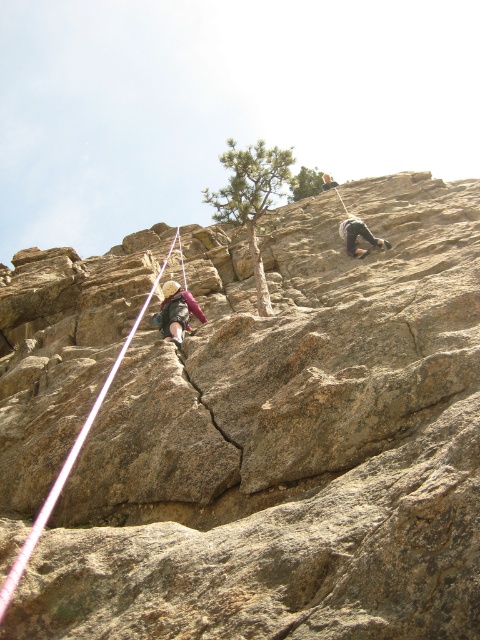
Based on the photo, does gray rough rock at center have a greater width compared to white nylon rope at left?

Indeed, gray rough rock at center has a greater width compared to white nylon rope at left.

Can you confirm if gray rough rock at center is taller than white nylon rope at left?

Correct, gray rough rock at center is much taller as white nylon rope at left.

Which is in front, point (144, 353) or point (117, 358)?

Point (144, 353) is more forward.

Locate an element on the screen. gray rough rock at center is located at coordinates (287, 444).

Between white nylon rope at left and light brown leather helmet at upper center, which one appears on the right side from the viewer's perspective?

light brown leather helmet at upper center

Can you confirm if white nylon rope at left is bigger than light brown leather helmet at upper center?

No.

This screenshot has height=640, width=480. Describe the element at coordinates (71, 458) in the screenshot. I see `white nylon rope at left` at that location.

This screenshot has height=640, width=480. Find the location of `white nylon rope at left`. white nylon rope at left is located at coordinates (71, 458).

The image size is (480, 640). I want to click on dark gray rock climber at right, so click(x=359, y=234).

Can you confirm if dark gray rock climber at right is taller than light brown leather helmet at upper center?

Incorrect, dark gray rock climber at right's height is not larger of light brown leather helmet at upper center's.

Does point (343, 221) lie in front of point (325, 186)?

Yes, point (343, 221) is closer to viewer.

What are the coordinates of `dark gray rock climber at right` in the screenshot? It's located at (359, 234).